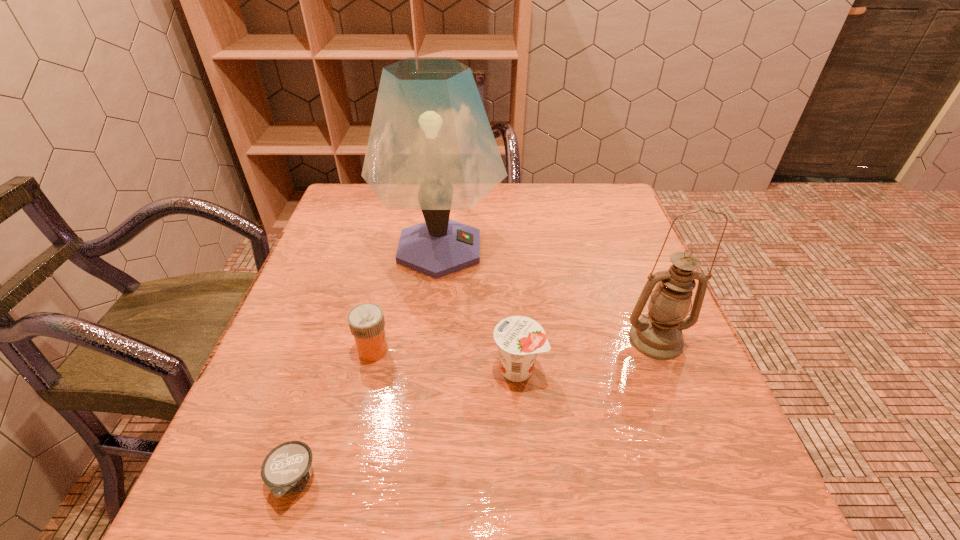
The image size is (960, 540). Find the location of `object at the near left corner`. object at the near left corner is located at coordinates (287, 468).

Locate an element on the screen. This screenshot has height=540, width=960. vacant space at the far edge is located at coordinates (501, 206).

Locate an element on the screen. vacant region at the near edge of the desktop is located at coordinates (333, 495).

Find the location of a particular element. This screenshot has height=540, width=960. vacant space at the left edge of the desktop is located at coordinates (260, 400).

In the image, there is a desktop. Where is `vacant space at the right edge`? This screenshot has width=960, height=540. vacant space at the right edge is located at coordinates (623, 238).

Identify the location of free region at the far right corner of the desktop. (589, 192).

The width and height of the screenshot is (960, 540). I want to click on vacant space at the near right corner of the desktop, so click(660, 517).

The width and height of the screenshot is (960, 540). I want to click on blank region between the nearer yogurt and the lampshade, so click(x=367, y=364).

At what (x,y) coordinates should I click in order to perform the action: click on free space between the shortest object and the lampshade. Please return your answer as a coordinate pair (x, y). This screenshot has width=960, height=540. Looking at the image, I should click on (367, 364).

This screenshot has width=960, height=540. I want to click on free space between the rightmost object and the tallest object, so click(x=548, y=294).